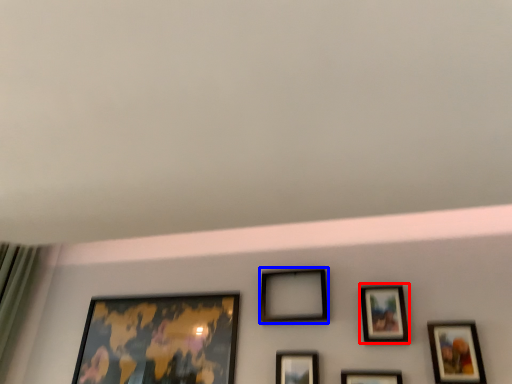
Question: Among these objects, which one is nearest to the camera, picture frame (highlighted by a red box) or picture frame (highlighted by a blue box)?

Choices:
 (A) picture frame
 (B) picture frame

Answer: (A)